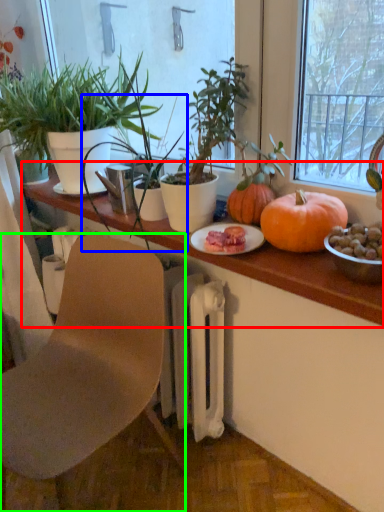
Question: Which object is the farthest from table (highlighted by a red box)? Choose among these: houseplant (highlighted by a blue box) or chair (highlighted by a green box).

Choices:
 (A) houseplant
 (B) chair

Answer: (B)